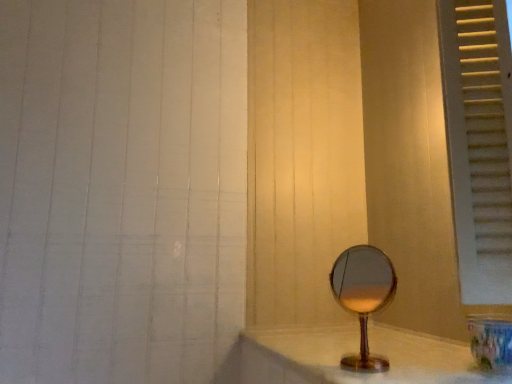
Question: Does white painted wood window frame at right have a greater width compared to translucent glass mirror at lower right?

Choices:
 (A) no
 (B) yes

Answer: (A)

Question: From a real-world perspective, is white painted wood window frame at right under translucent glass mirror at lower right?

Choices:
 (A) no
 (B) yes

Answer: (A)

Question: Is white painted wood window frame at right outside translucent glass mirror at lower right?

Choices:
 (A) no
 (B) yes

Answer: (B)

Question: Are white painted wood window frame at right and translucent glass mirror at lower right far apart?

Choices:
 (A) no
 (B) yes

Answer: (A)

Question: Is white painted wood window frame at right facing away from translucent glass mirror at lower right?

Choices:
 (A) no
 (B) yes

Answer: (A)

Question: Is white painted wood window frame at right spatially inside wooden mirror at center, or outside of it?

Choices:
 (A) inside
 (B) outside

Answer: (B)

Question: From a real-world perspective, is white painted wood window frame at right above or below wooden mirror at center?

Choices:
 (A) below
 (B) above

Answer: (B)

Question: From the image's perspective, is white painted wood window frame at right above or below wooden mirror at center?

Choices:
 (A) above
 (B) below

Answer: (A)

Question: Is point click(x=503, y=148) closer or farther from the camera than point click(x=362, y=327)?

Choices:
 (A) closer
 (B) farther

Answer: (A)

Question: Is white painted wood window frame at right spatially inside translucent glass mirror at lower right, or outside of it?

Choices:
 (A) outside
 (B) inside

Answer: (A)

Question: From a real-world perspective, is white painted wood window frame at right physically located above or below translucent glass mirror at lower right?

Choices:
 (A) above
 (B) below

Answer: (A)

Question: From the image's perspective, is white painted wood window frame at right located above or below translucent glass mirror at lower right?

Choices:
 (A) above
 (B) below

Answer: (A)

Question: Considering the positions of white painted wood window frame at right and translucent glass mirror at lower right in the image, is white painted wood window frame at right wider or thinner than translucent glass mirror at lower right?

Choices:
 (A) wide
 (B) thin

Answer: (B)

Question: Does point (330, 362) appear closer or farther from the camera than point (476, 150)?

Choices:
 (A) closer
 (B) farther

Answer: (B)

Question: Considering the positions of translucent glass mirror at lower right and white painted wood window frame at right in the image, is translucent glass mirror at lower right taller or shorter than white painted wood window frame at right?

Choices:
 (A) short
 (B) tall

Answer: (A)